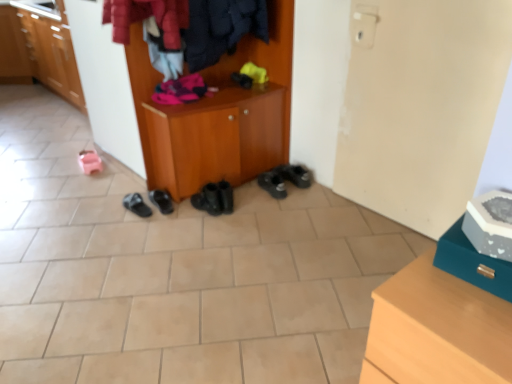
Image resolution: width=512 pixels, height=384 pixels. What are the coordinates of `vacant region in front of black rubber sandals at center, which appears as the second footwear when viewed from the left` in the screenshot? It's located at (126, 226).